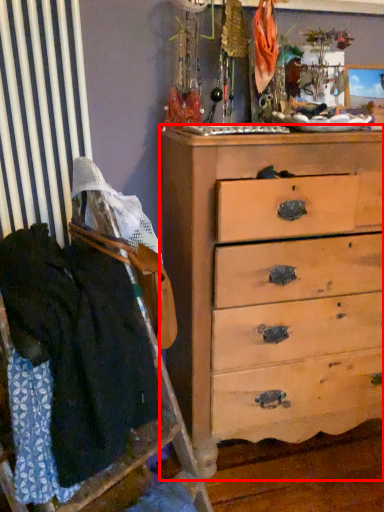
Question: From the image's perspective, where is chest of drawers (annotated by the red box) located relative to clothing?

Choices:
 (A) below
 (B) above

Answer: (B)